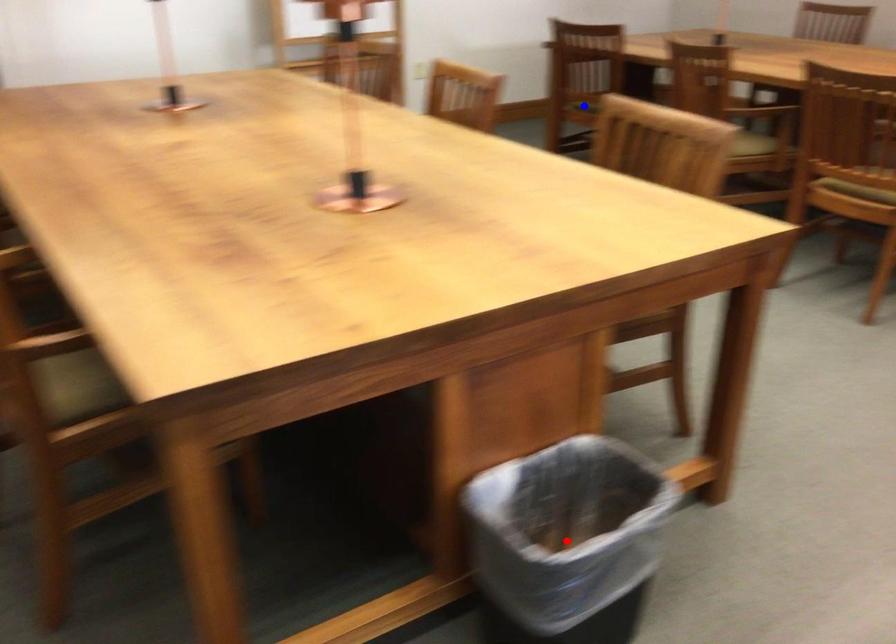
Question: Which of the two points in the image is closer to the camera?

Choices:
 (A) Blue point is closer.
 (B) Red point is closer.

Answer: (B)